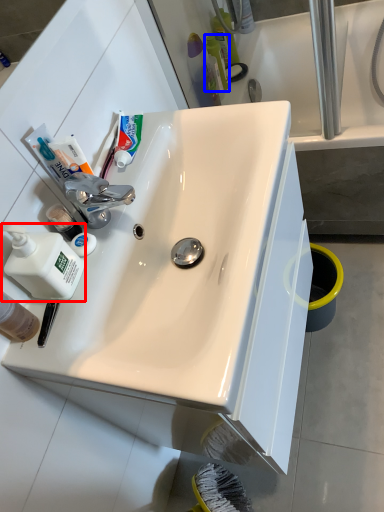
Question: Which of the following is the farthest to the observer, cleaning product (highlighted by a red box) or toiletry (highlighted by a blue box)?

Choices:
 (A) cleaning product
 (B) toiletry

Answer: (B)